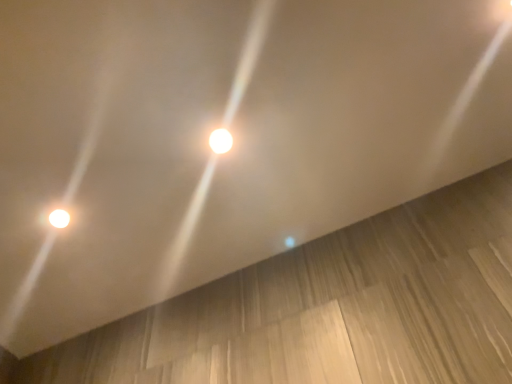
Question: Is light brown wood at lower right located outside white glossy light at center, the first lamp when ordered from front to back?

Choices:
 (A) no
 (B) yes

Answer: (B)

Question: Can you confirm if light brown wood at lower right is taller than white glossy light at center, which is the 2th lamp in left-to-right order?

Choices:
 (A) yes
 (B) no

Answer: (A)

Question: Is light brown wood at lower right at the left side of white glossy light at center, the second lamp in the bottom-to-top sequence?

Choices:
 (A) yes
 (B) no

Answer: (A)

Question: Is light brown wood at lower right behind white glossy light at center, the first lamp when ordered from front to back?

Choices:
 (A) no
 (B) yes

Answer: (A)

Question: Can you confirm if light brown wood at lower right is positioned to the right of white glossy light at center, the 1th lamp in the top-to-bottom sequence?

Choices:
 (A) no
 (B) yes

Answer: (A)

Question: Do you think light brown wood at lower right is within white glossy light at center, the first lamp when ordered from front to back, or outside of it?

Choices:
 (A) outside
 (B) inside

Answer: (A)

Question: Is light brown wood at lower right to the left or to the right of white glossy light at center, the second lamp in the bottom-to-top sequence, in the image?

Choices:
 (A) left
 (B) right

Answer: (A)

Question: From their relative heights in the image, would you say light brown wood at lower right is taller or shorter than white glossy light at center, the second lamp in the bottom-to-top sequence?

Choices:
 (A) short
 (B) tall

Answer: (B)

Question: Is light brown wood at lower right wider or thinner than white glossy light at center, arranged as the first lamp when viewed from the right?

Choices:
 (A) thin
 (B) wide

Answer: (B)

Question: Choose the correct answer: Is matte white lamp at lower left, which appears as the 2th lamp when viewed from the front, inside white glossy light at center, the 1th lamp in the top-to-bottom sequence, or outside it?

Choices:
 (A) inside
 (B) outside

Answer: (B)

Question: Is matte white lamp at lower left, the first lamp in the bottom-to-top sequence, taller or shorter than white glossy light at center, the second lamp viewed from the back?

Choices:
 (A) short
 (B) tall

Answer: (A)

Question: Looking at their shapes, would you say matte white lamp at lower left, arranged as the second lamp when viewed from the right, is wider or thinner than white glossy light at center, the first lamp when ordered from front to back?

Choices:
 (A) thin
 (B) wide

Answer: (B)

Question: From a real-world perspective, is matte white lamp at lower left, arranged as the second lamp when viewed from the right, above or below white glossy light at center, arranged as the first lamp when viewed from the right?

Choices:
 (A) above
 (B) below

Answer: (A)

Question: From their relative heights in the image, would you say light brown wood at lower right is taller or shorter than matte white lamp at lower left, the first lamp in the bottom-to-top sequence?

Choices:
 (A) tall
 (B) short

Answer: (A)

Question: In the image, is light brown wood at lower right positioned in front of or behind matte white lamp at lower left, which is the 1th lamp in left-to-right order?

Choices:
 (A) behind
 (B) front

Answer: (B)